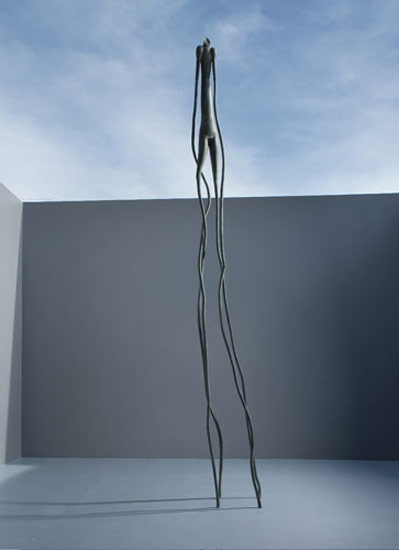
Locate an element on the screen. The width and height of the screenshot is (399, 550). dark grey wall is located at coordinates click(278, 309).